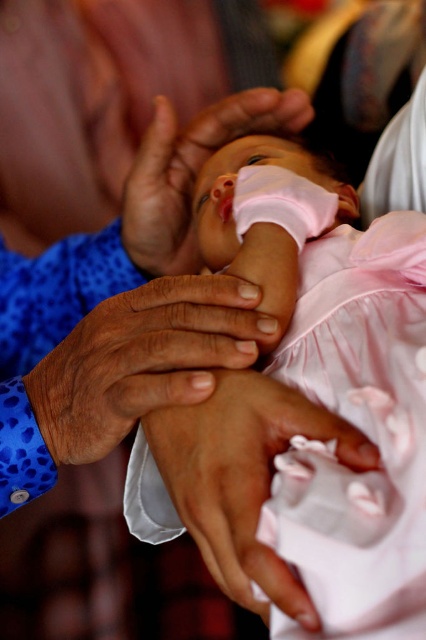
Based on the coordinates provided in the scene, where is the smooth skin hand at center located in the image?

The smooth skin hand at center is located at the 2D coordinates point (141,358).

You are a photographer trying to capture a closeup of the smooth skin hand at center. The camera you are using has a minimum focusing distance of 30 centimeters. Can you take the photo without moving closer than 30 centimeters?

The smooth skin hand at center is 39.38 centimeters from the viewer, which is beyond the camera minimum focusing distance of 30 centimeters. Therefore, you can take the photo without moving closer than 30 centimeters.

You are a nurse preparing to measure the circumference of the pink satin baby hand at center and the pink fabric at center. Which object has a smaller circumference?

The pink satin baby hand at center has a smaller circumference than the pink fabric at center because it is thinner.